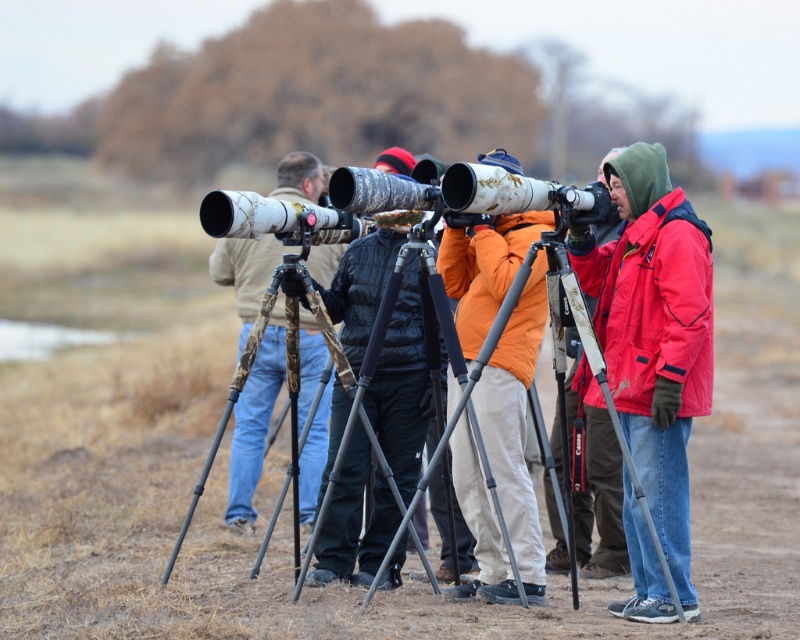
Which is in front, point (388, 465) or point (302, 419)?

Point (388, 465) is in front.

You are a GUI agent. You are given a task and a screenshot of the screen. Output one action in this format:
    pyautogui.click(x=<x>, y=<y>)
    Task: Click on the camouflage-patterned tripod at center
    Image resolution: width=800 pixels, height=640 pixels.
    Given the screenshot: What is the action you would take?
    pyautogui.click(x=402, y=387)

Can you confirm if camouflage-patterned tripod at center is positioned above matte black jacket at right?

No, camouflage-patterned tripod at center is not above matte black jacket at right.

Based on the photo, between camouflage-patterned tripod at center and matte black jacket at right, which one has more height?

matte black jacket at right

Is point (396, 388) closer to viewer compared to point (570, 429)?

Yes.

What are the coordinates of `camouflage-patterned tripod at center` in the screenshot? It's located at (402, 387).

Does orange fleece jacket at center appear under silver metallic tripod at center?

Incorrect, orange fleece jacket at center is not positioned below silver metallic tripod at center.

Which is more to the left, orange fleece jacket at center or silver metallic tripod at center?

orange fleece jacket at center

Identify the location of orange fleece jacket at center. The width and height of the screenshot is (800, 640). (516, 426).

At what (x,y) coordinates should I click in order to perform the action: click on orange fleece jacket at center. Please return your answer as a coordinate pair (x, y). The width and height of the screenshot is (800, 640). Looking at the image, I should click on (516, 426).